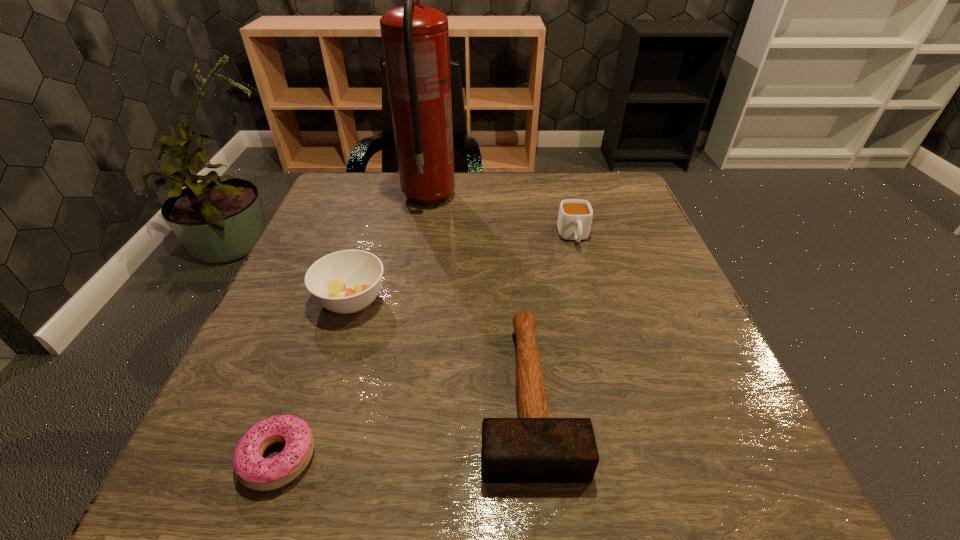
The height and width of the screenshot is (540, 960). I want to click on the farthest object, so click(x=415, y=38).

Find the location of a particular element. the tallest object is located at coordinates (415, 38).

This screenshot has width=960, height=540. I want to click on the second farthest object, so click(575, 216).

This screenshot has height=540, width=960. Identify the location of cup. (575, 216).

What are the coordinates of `soup bowl` in the screenshot? It's located at (347, 281).

Where is `mallet`? mallet is located at coordinates (533, 448).

At what (x,y) coordinates should I click in order to perform the action: click on the shortest object. Please return your answer as a coordinate pair (x, y). Looking at the image, I should click on (255, 472).

Where is `vacant region located 0.320m on the side with the handle of the fourth nearest object`? This screenshot has width=960, height=540. vacant region located 0.320m on the side with the handle of the fourth nearest object is located at coordinates (609, 367).

Identify the location of vacant point located 0.300m on the front of the third farthest object. The width and height of the screenshot is (960, 540). (291, 492).

Identify the location of free location located 0.320m on the right of the shortest object. This screenshot has width=960, height=540. (540, 458).